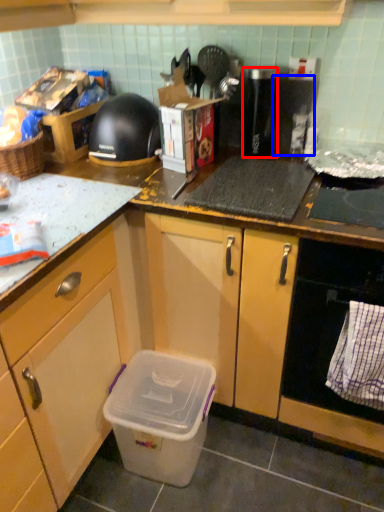
Question: Among these objects, which one is nearest to the camera, appliance (highlighted by a red box) or appliance (highlighted by a blue box)?

Choices:
 (A) appliance
 (B) appliance

Answer: (A)